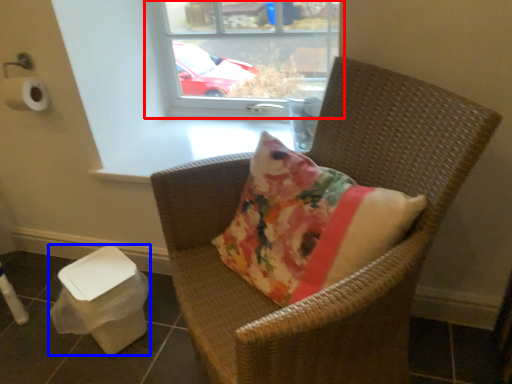
Question: Which object appears farthest to the camera in this image, window (highlighted by a red box) or potty (highlighted by a blue box)?

Choices:
 (A) window
 (B) potty

Answer: (A)